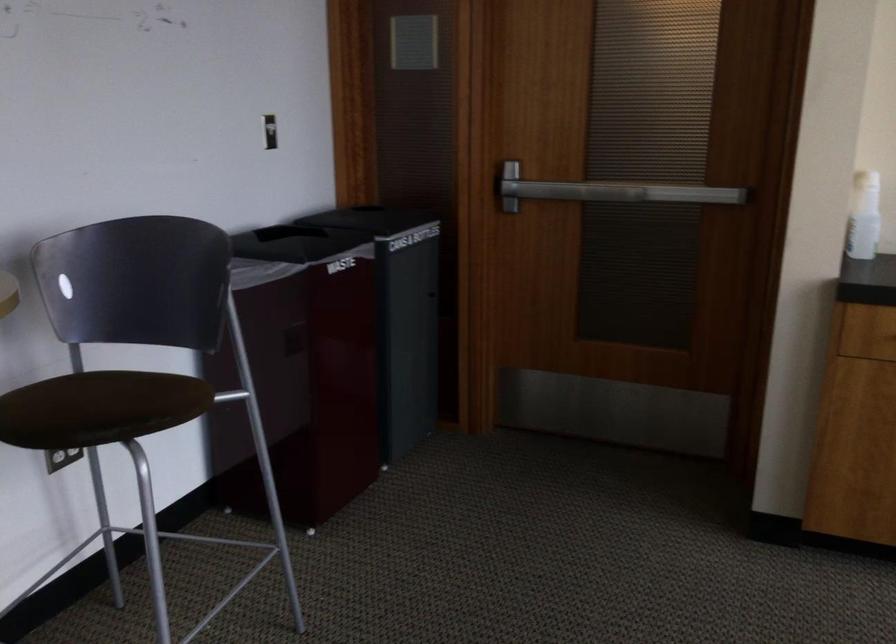
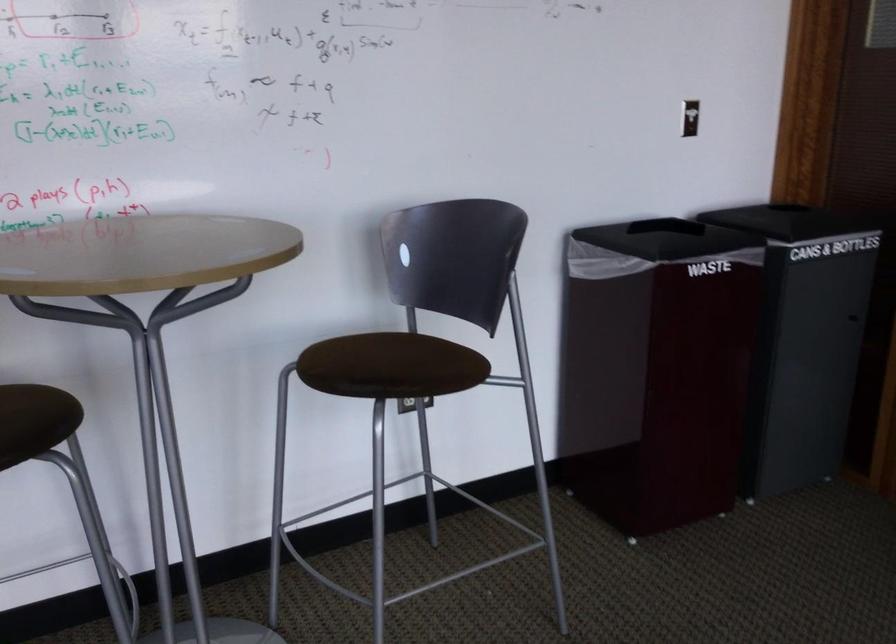
Locate, in the second image, the point that corresponds to the point at 286,136 in the first image.

(690, 118)